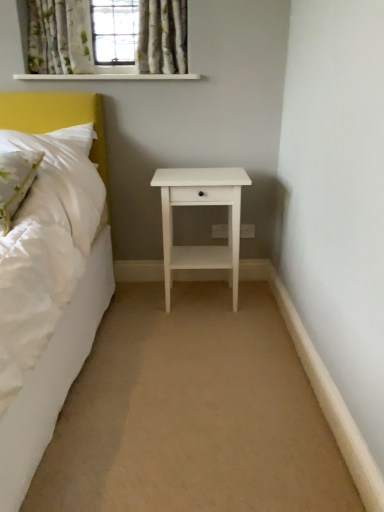
Image resolution: width=384 pixels, height=512 pixels. I want to click on vacant space situated above beige carpet at center (from a real-world perspective), so click(176, 361).